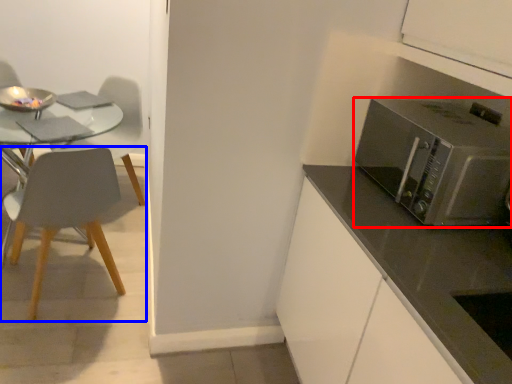
Question: Which of the following is the closest to the observer, microwave oven (highlighted by a red box) or chair (highlighted by a blue box)?

Choices:
 (A) microwave oven
 (B) chair

Answer: (A)